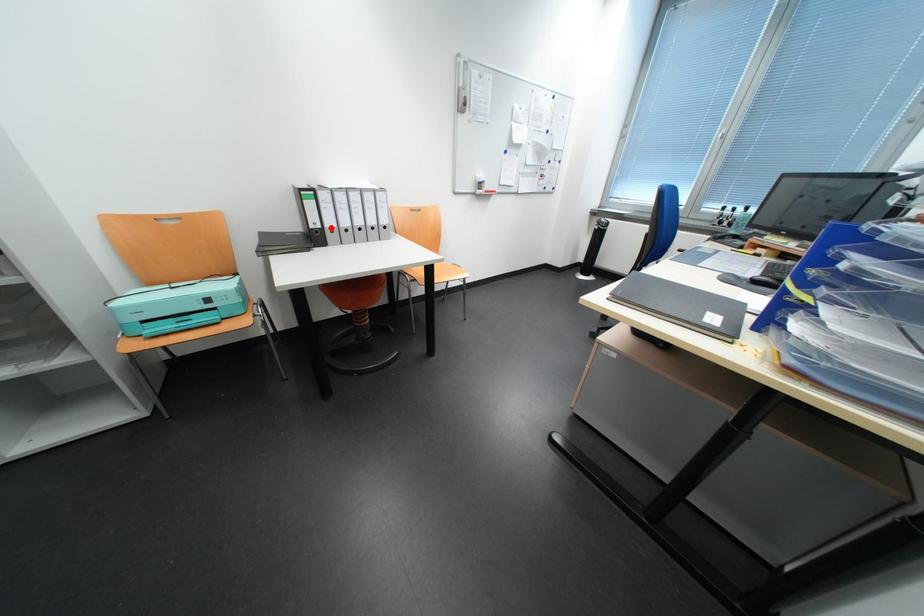
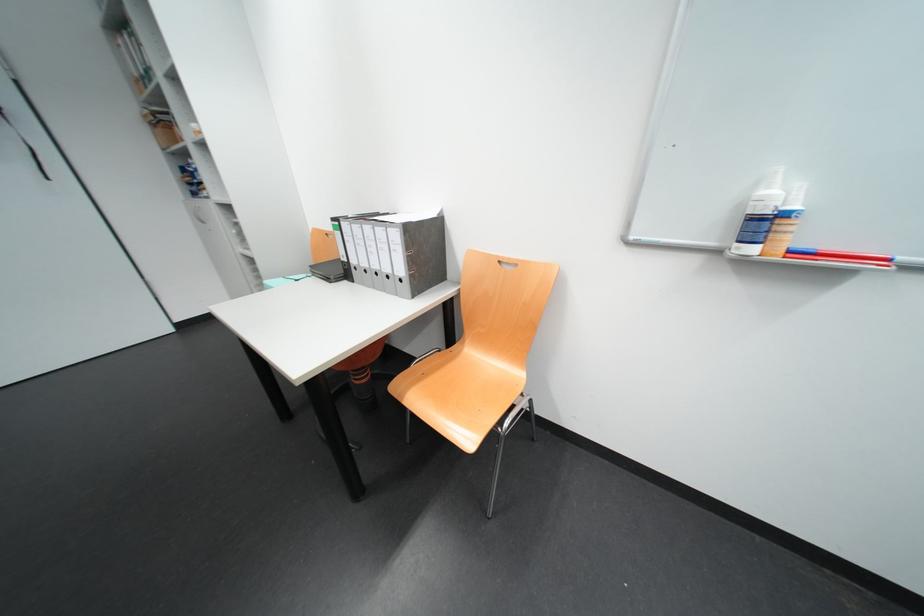
Locate, in the second image, the point that corresponds to the highlighted location in the first image.

(358, 262)